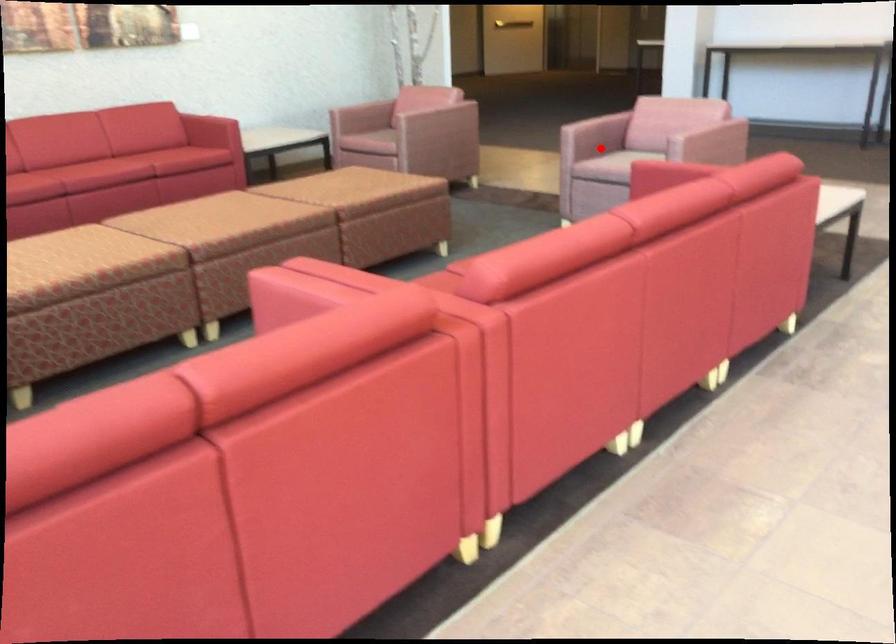
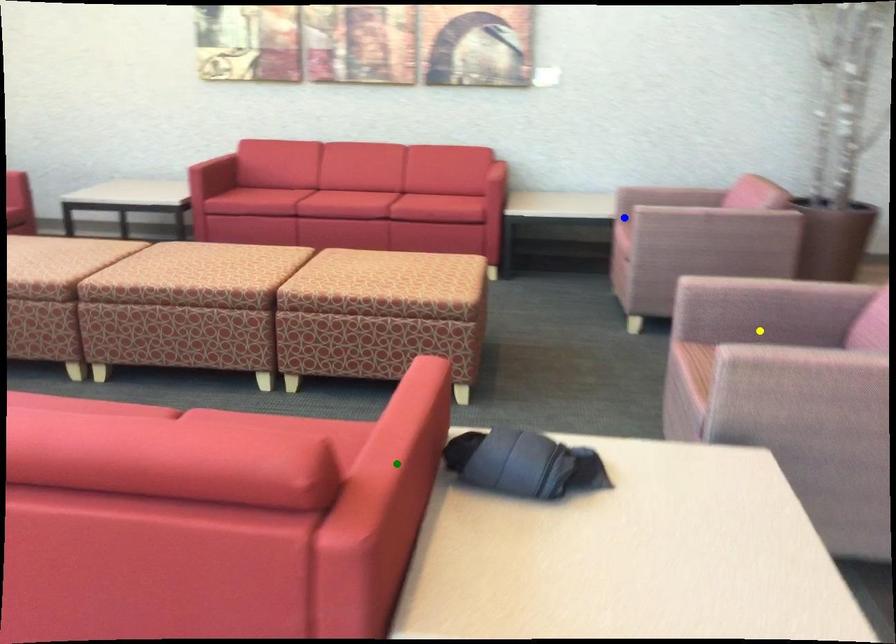
Question: I am providing you with two images of the same scene from different viewpoints. A red point is marked on the first image. You are given multiple points on the second image. In image 2, which mark is for the same physical point as the one in image 1?

Choices:
 (A) yellow point
 (B) blue point
 (C) green point

Answer: (A)